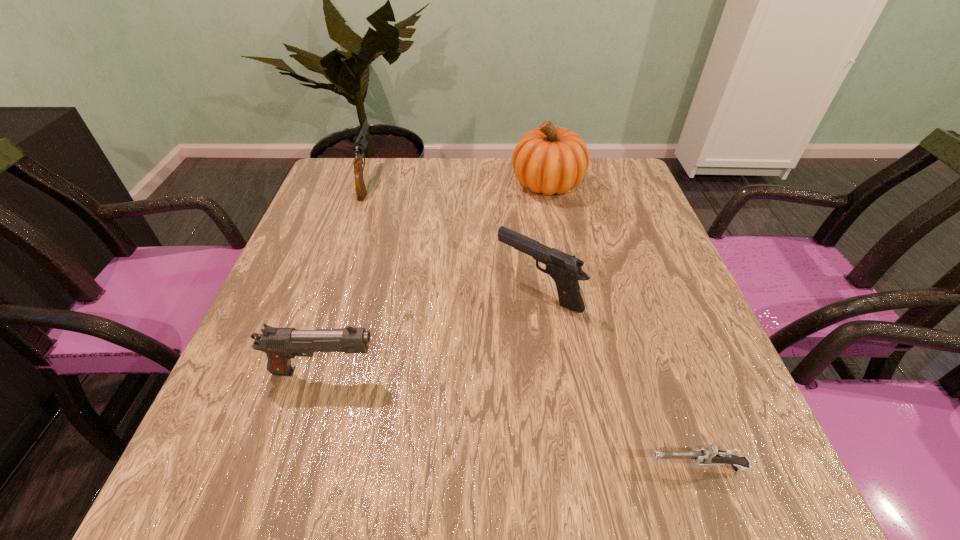
Locate an element on the screen. This screenshot has width=960, height=540. free spot between the second farthest gun and the farthest gun is located at coordinates (452, 235).

Find the location of `unoccupied area between the third farthest gun and the farthest gun`. unoccupied area between the third farthest gun and the farthest gun is located at coordinates (346, 275).

Where is `empty location between the second nearest gun and the tallest object`? Image resolution: width=960 pixels, height=540 pixels. empty location between the second nearest gun and the tallest object is located at coordinates (436, 277).

This screenshot has height=540, width=960. What are the coordinates of `vacant area that lies between the third farthest object and the pumpkin` in the screenshot? It's located at (542, 237).

At what (x,y) coordinates should I click in order to perform the action: click on vacant region between the farthest gun and the pumpkin. Please return your answer as a coordinate pair (x, y). The height and width of the screenshot is (540, 960). Looking at the image, I should click on (457, 181).

At what (x,y) coordinates should I click in order to perform the action: click on vacant space in between the nearest object and the third nearest object. Please return your answer as a coordinate pair (x, y). Looking at the image, I should click on (617, 379).

You are a GUI agent. You are given a task and a screenshot of the screen. Output one action in this format:
    pyautogui.click(x=<x>, y=<y>)
    Task: Click on the vacant region between the farthest gun and the second farthest gun
    Image resolution: width=960 pixels, height=540 pixels.
    Given the screenshot: What is the action you would take?
    pyautogui.click(x=452, y=235)

You are a GUI agent. You are given a task and a screenshot of the screen. Output one action in this format:
    pyautogui.click(x=<x>, y=<y>)
    Task: Click on the vacant area that lies between the tallest object and the shortest object
    The width and height of the screenshot is (960, 540).
    Given the screenshot: What is the action you would take?
    pyautogui.click(x=622, y=325)

At what (x,y) coordinates should I click in order to perform the action: click on vacant region between the pumpkin and the shortest object. Please return your answer as a coordinate pair (x, y). The height and width of the screenshot is (540, 960). Looking at the image, I should click on (622, 325).

You are a GUI agent. You are given a task and a screenshot of the screen. Output one action in this format:
    pyautogui.click(x=<x>, y=<y>)
    Task: Click on the free area in between the third farthest gun and the third nearest gun
    
    Given the screenshot: What is the action you would take?
    pyautogui.click(x=431, y=332)